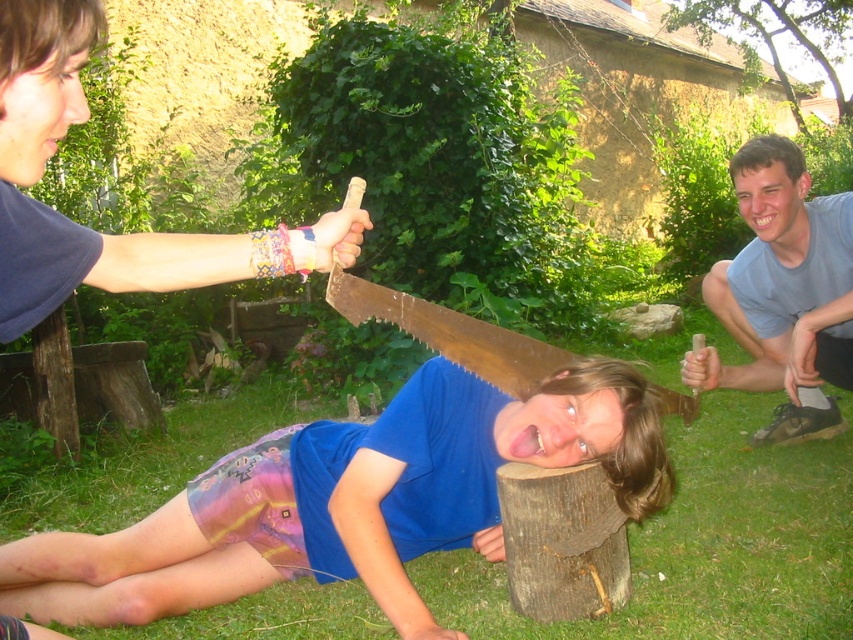
Question: Can you confirm if green grass at lower center is smaller than gray cotton shirt at lower right?

Choices:
 (A) no
 (B) yes

Answer: (A)

Question: Which of the following is the closest to the observer?

Choices:
 (A) green grass at lower center
 (B) gray cotton shirt at lower right

Answer: (A)

Question: Does green grass at lower center have a larger size compared to gray cotton shirt at lower right?

Choices:
 (A) yes
 (B) no

Answer: (A)

Question: Is green grass at lower center above gray cotton shirt at lower right?

Choices:
 (A) yes
 (B) no

Answer: (B)

Question: Which of the following is the closest to the observer?

Choices:
 (A) (761, 372)
 (B) (795, 580)

Answer: (B)